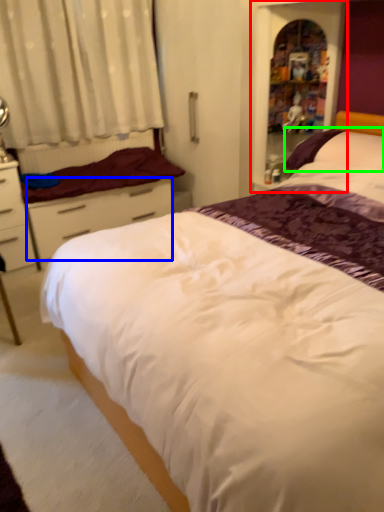
Question: Based on their relative distances, which object is farther from bookshelf (highlighted by a red box)? Choose from drawer (highlighted by a blue box) and pillow (highlighted by a green box).

Choices:
 (A) drawer
 (B) pillow

Answer: (A)